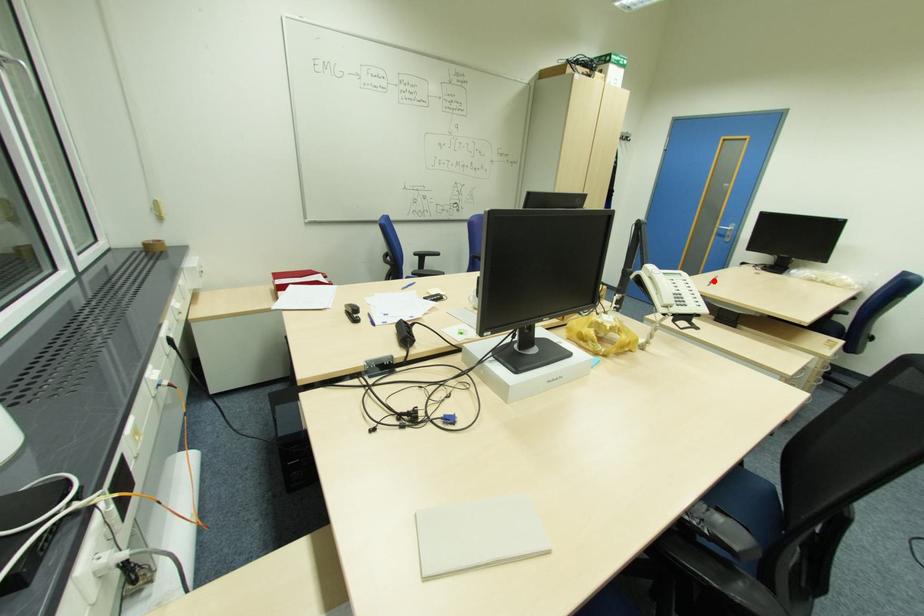
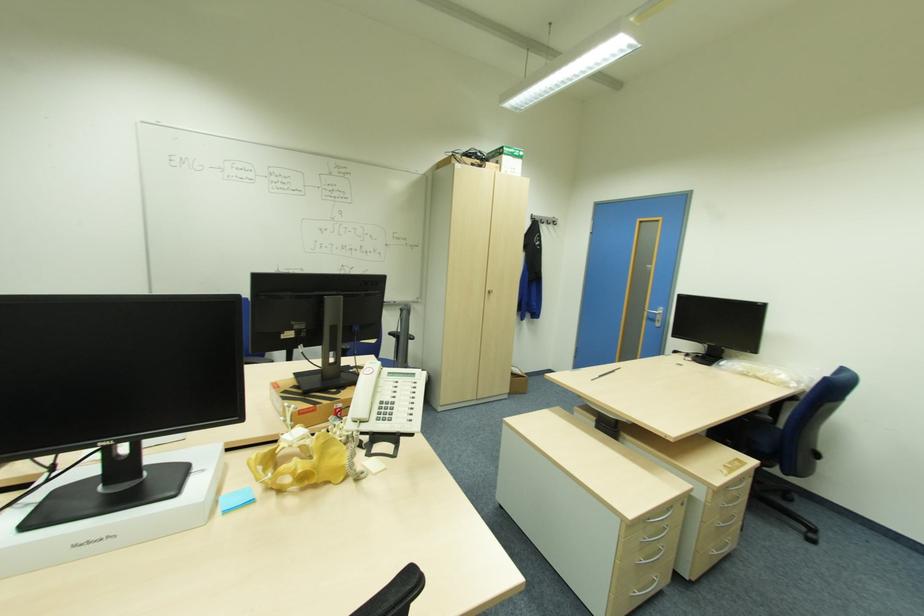
Question: I am providing you with two images of the same scene from different viewpoints. In image1, a red point is highlighted. Considering the same 3D point in image2, which of the following is correct?

Choices:
 (A) It is closer
 (B) It is farther

Answer: (A)